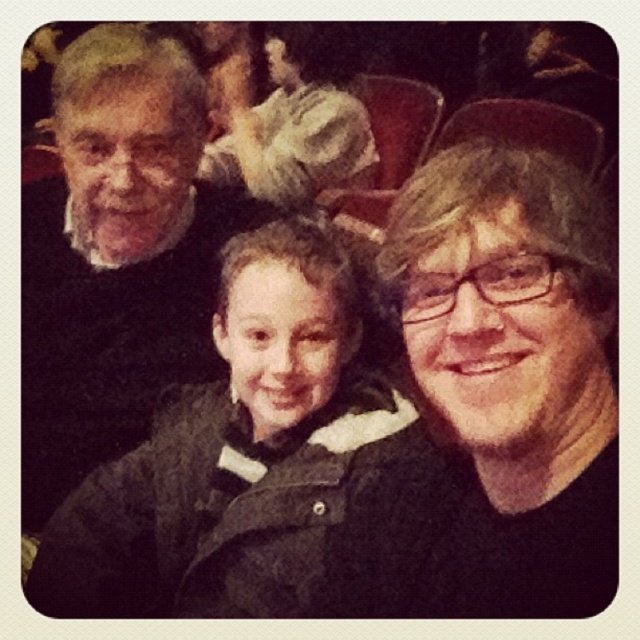
Question: From the image, what is the correct spatial relationship of dark gray fuzzy coat at center in relation to fuzzy fabric flower at upper center?

Choices:
 (A) above
 (B) below

Answer: (B)

Question: Can you confirm if matte black jacket at center is thinner than fuzzy fabric flower at upper center?

Choices:
 (A) no
 (B) yes

Answer: (B)

Question: Which of the following is the closest to the observer?

Choices:
 (A) (230, 26)
 (B) (147, 196)
 (C) (228, 412)

Answer: (B)

Question: Based on their relative distances, which object is nearer to the dark gray sweater at upper left?

Choices:
 (A) dark gray fuzzy coat at center
 (B) fuzzy fabric flower at upper center

Answer: (A)

Question: Can you confirm if dark gray fuzzy coat at center is wider than dark gray sweater at upper left?

Choices:
 (A) yes
 (B) no

Answer: (A)

Question: Which object appears closest to the camera in this image?

Choices:
 (A) fuzzy fabric flower at upper center
 (B) matte black jacket at center
 (C) dark gray fuzzy coat at center
 (D) dark gray sweater at upper left

Answer: (B)